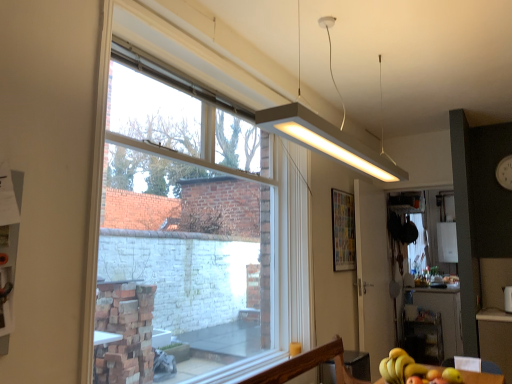
Question: From their relative heights in the image, would you say yellow matte bananas at lower right is taller or shorter than white matte rectangular light fixture at upper center?

Choices:
 (A) tall
 (B) short

Answer: (B)

Question: Looking at their shapes, would you say yellow matte bananas at lower right is wider or thinner than white matte rectangular light fixture at upper center?

Choices:
 (A) wide
 (B) thin

Answer: (B)

Question: Considering the real-world distances, which object is closest to the white matte rectangular light fixture at upper center?

Choices:
 (A) white glossy screen door at center
 (B) multicolored paper at upper right
 (C) wooden table at lower right, acting as the 2th table starting from the right
 (D) green matte apple at lower right
 (E) yellow matte bananas at lower right

Answer: (E)

Question: Based on their relative distances, which object is farther from the yellow matte bananas at lower right?

Choices:
 (A) clear glass window at center
 (B) white glossy screen door at center
 (C) green matte apple at lower right
 (D) wooden table at lower right, placed as the first table when sorted from front to back
 (E) white plastic clock at upper right

Answer: (A)